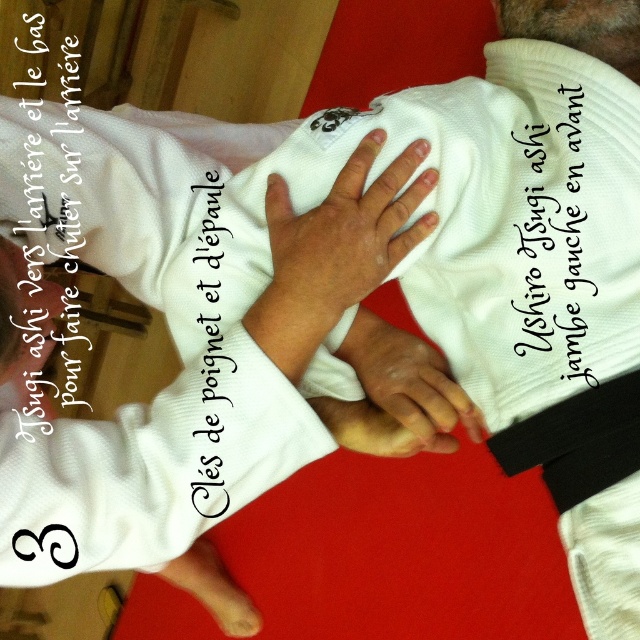
What are the coordinates of the white ribbed robe at center in the image?

The white ribbed robe at center is located at coordinates point (173, 337).

You are a martial arts instructor observing a Judo technique called Ushiro Tsugi Ashi. You notice two objects at the center of the image. What is the relationship between the white ribbed robe at center and the black paper text at center in terms of size?

The white ribbed robe at center is larger in size than the black paper text at center.